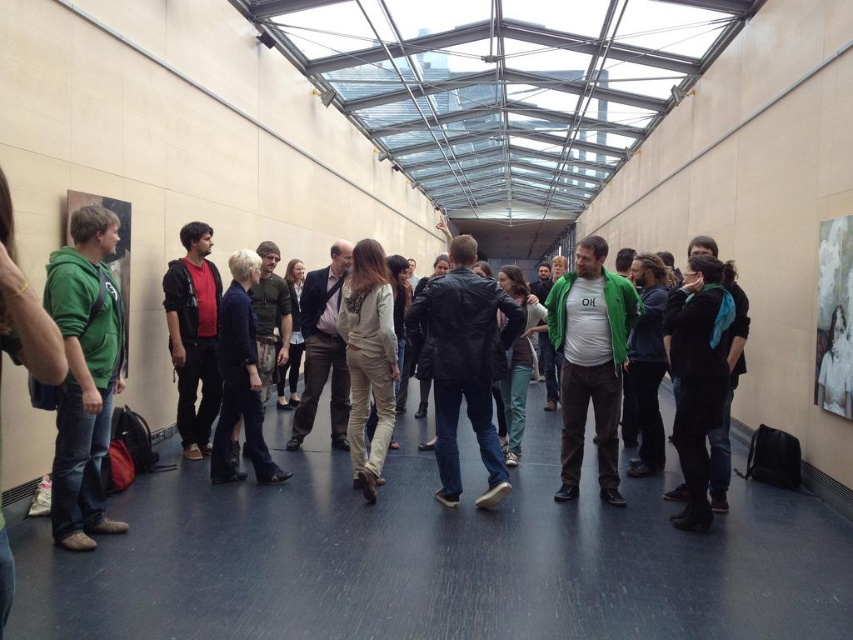
Between leather jacket at center and dark red hoodie at center, which one appears on the left side from the viewer's perspective?

dark red hoodie at center is more to the left.

Who is lower down, leather jacket at center or dark red hoodie at center?

leather jacket at center is lower down.

Is point (485, 508) positioned after point (186, 308)?

That is False.

In order to click on leather jacket at center in this screenshot , I will do `click(465, 364)`.

Is green fleece jacket at left to the right of leather jacket at center from the viewer's perspective?

No, green fleece jacket at left is not to the right of leather jacket at center.

Between green fleece jacket at left and leather jacket at center, which one appears on the right side from the viewer's perspective?

From the viewer's perspective, leather jacket at center appears more on the right side.

Image resolution: width=853 pixels, height=640 pixels. What do you see at coordinates (84, 374) in the screenshot?
I see `green fleece jacket at left` at bounding box center [84, 374].

The image size is (853, 640). Identify the location of green fleece jacket at left. (84, 374).

Does point (85, 248) come farther from viewer compared to point (206, 420)?

That is False.

Between green fleece jacket at left and dark red hoodie at center, which one has less height?

With less height is green fleece jacket at left.

Is point (80, 332) positioned before point (199, 436)?

Yes, point (80, 332) is in front of point (199, 436).

The height and width of the screenshot is (640, 853). What are the coordinates of `green fleece jacket at left` in the screenshot? It's located at (84, 374).